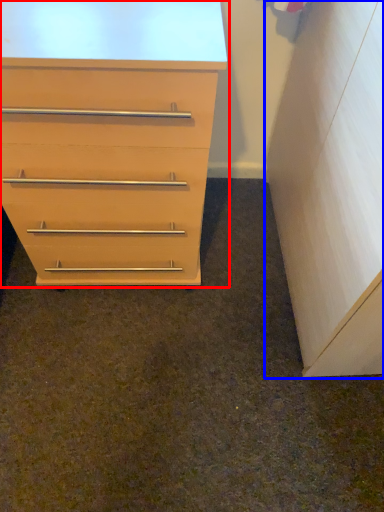
Question: Among these objects, which one is nearest to the camera, chest of drawers (highlighted by a red box) or file cabinet (highlighted by a blue box)?

Choices:
 (A) chest of drawers
 (B) file cabinet

Answer: (B)